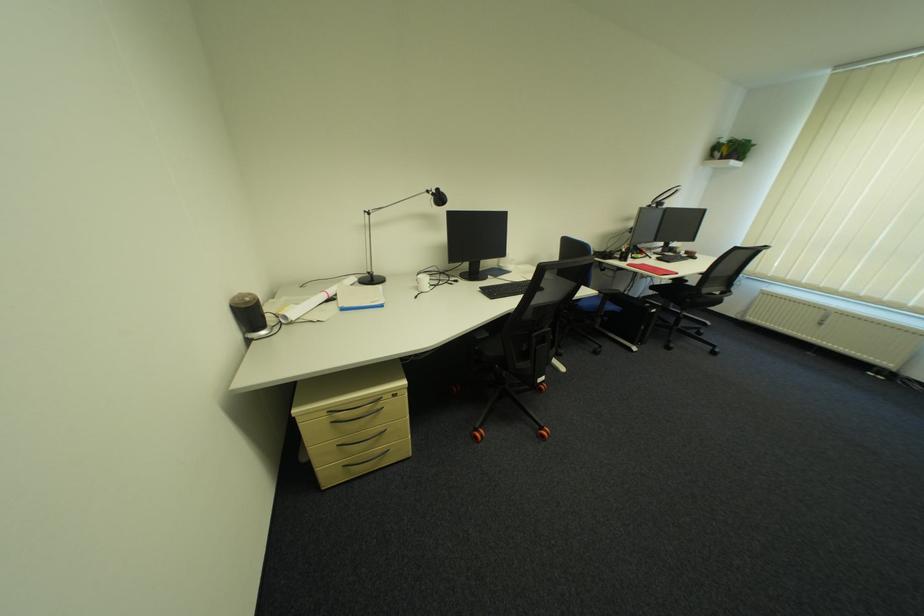
Where is `black cylindrical speaker`? This screenshot has width=924, height=616. black cylindrical speaker is located at coordinates (249, 315).